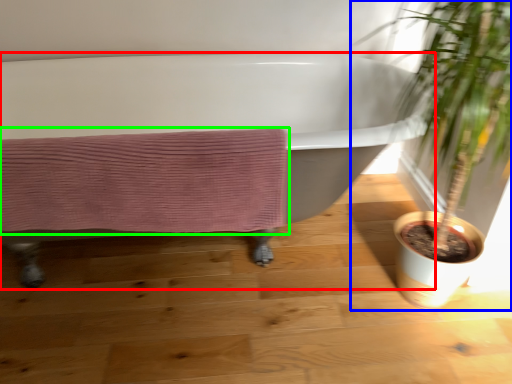
Question: Estimate the real-world distances between objects in this image. Which object is farther from bathtub (highlighted by a red box), houseplant (highlighted by a blue box) or bath towel (highlighted by a green box)?

Choices:
 (A) houseplant
 (B) bath towel

Answer: (B)